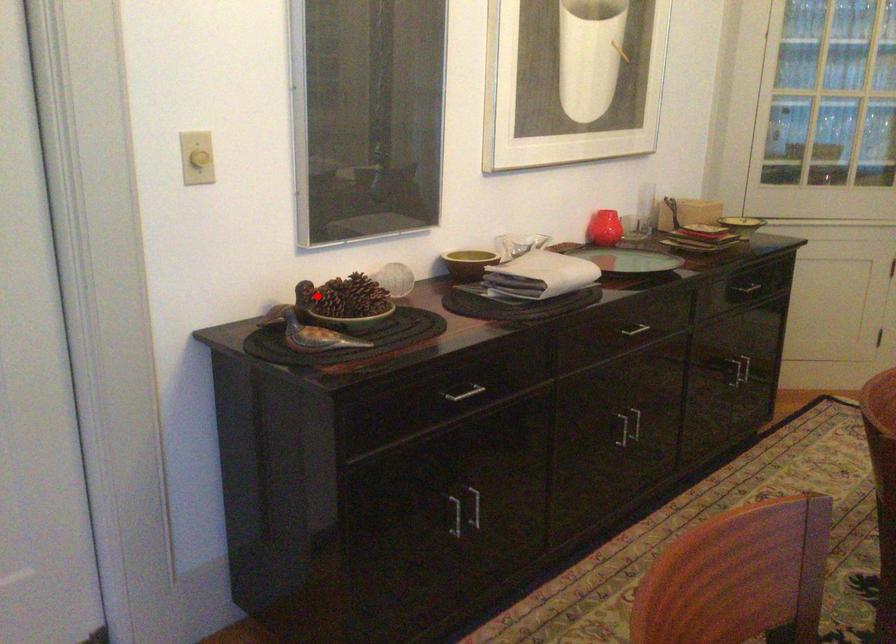
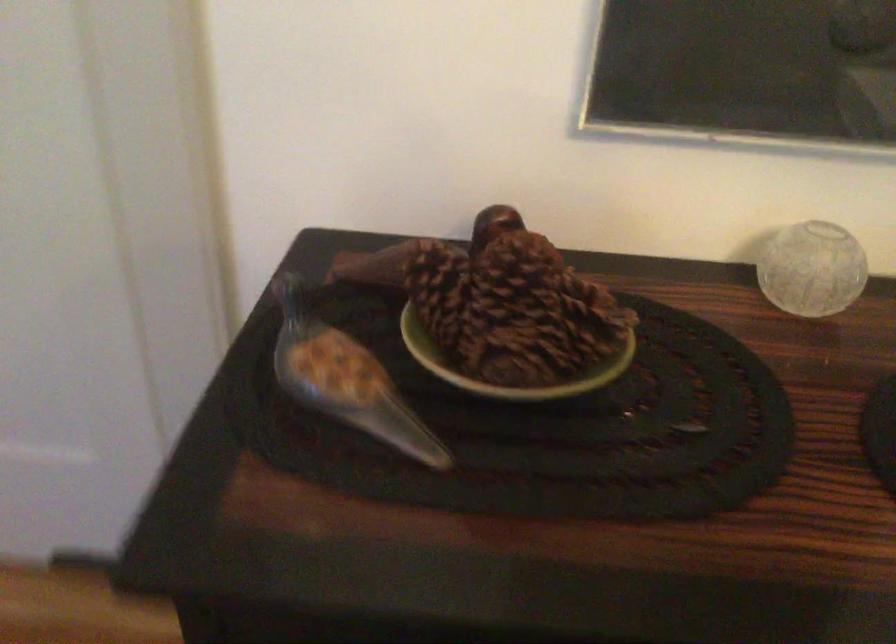
Find the pixel in the second image that matches the highlighted location in the first image.

(440, 292)